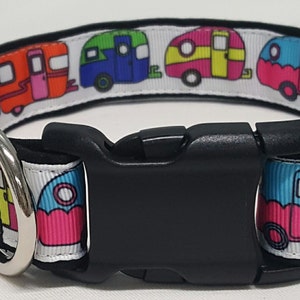
This screenshot has width=300, height=300. I want to click on table, so click(127, 119).